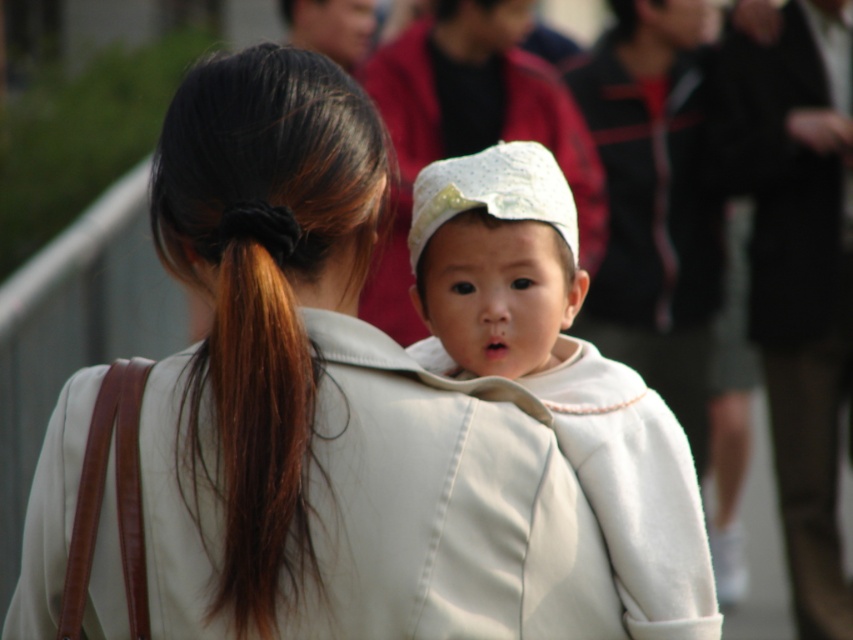
Does white leather jacket at center have a larger size compared to brown silky hair at upper left?

Yes, white leather jacket at center is bigger than brown silky hair at upper left.

In the scene shown: Does white leather jacket at center come behind brown silky hair at upper left?

Yes.

Between point (296, 253) and point (218, 300), which one is positioned in front?

Point (218, 300)

The height and width of the screenshot is (640, 853). Find the location of `white leather jacket at center`. white leather jacket at center is located at coordinates (329, 403).

Can you confirm if white leather jacket at center is shorter than white soft hat at center?

Incorrect, white leather jacket at center's height does not fall short of white soft hat at center's.

Which is in front, point (523, 602) or point (646, 433)?

Positioned in front is point (523, 602).

Where is `white leather jacket at center`? This screenshot has height=640, width=853. white leather jacket at center is located at coordinates (329, 403).

Is white soft hat at center to the right of brown silky hair at upper left from the viewer's perspective?

Indeed, white soft hat at center is positioned on the right side of brown silky hair at upper left.

Does white soft hat at center have a smaller size compared to brown silky hair at upper left?

No.

Who is more distant from viewer, (463,352) or (294,280)?

The point (463,352) is behind.

Image resolution: width=853 pixels, height=640 pixels. I want to click on white soft hat at center, so click(560, 369).